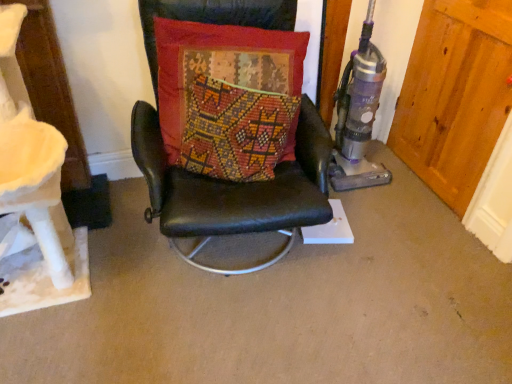
Locate an element on the screen. Image resolution: width=512 pixels, height=384 pixels. vacant space underneath black leather chair at center (from a real-world perspective) is located at coordinates (236, 255).